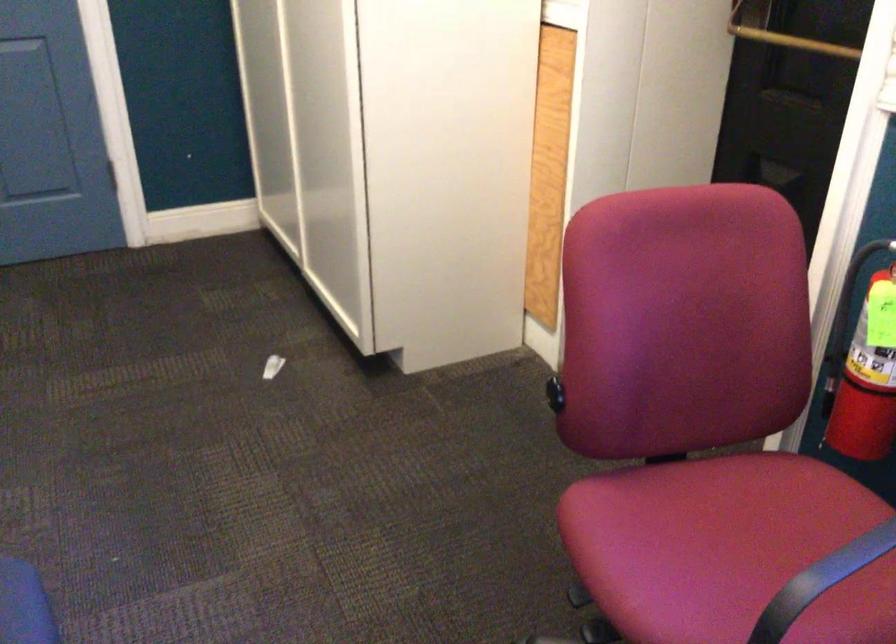
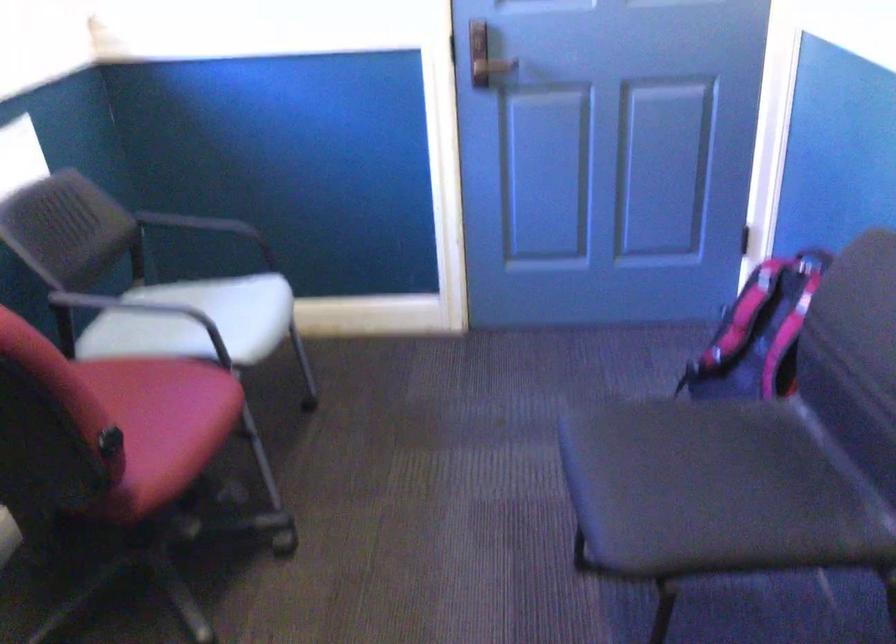
Question: I am providing you with two images of the same scene from different viewpoints. Which of the following objects are not visible in image2?

Choices:
 (A) green kiwi pouch
 (B) black chair armrest
 (C) black chair sitting surface
 (D) white chair sitting surface

Answer: (B)